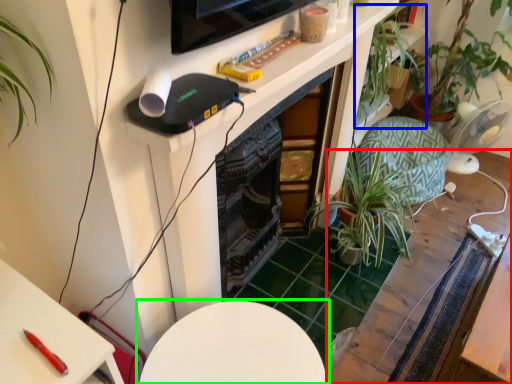
Question: Considering the real-world distances, which object is closest to table (highlighted by a red box)? vegetation (highlighted by a blue box) or table (highlighted by a green box).

Choices:
 (A) vegetation
 (B) table

Answer: (B)